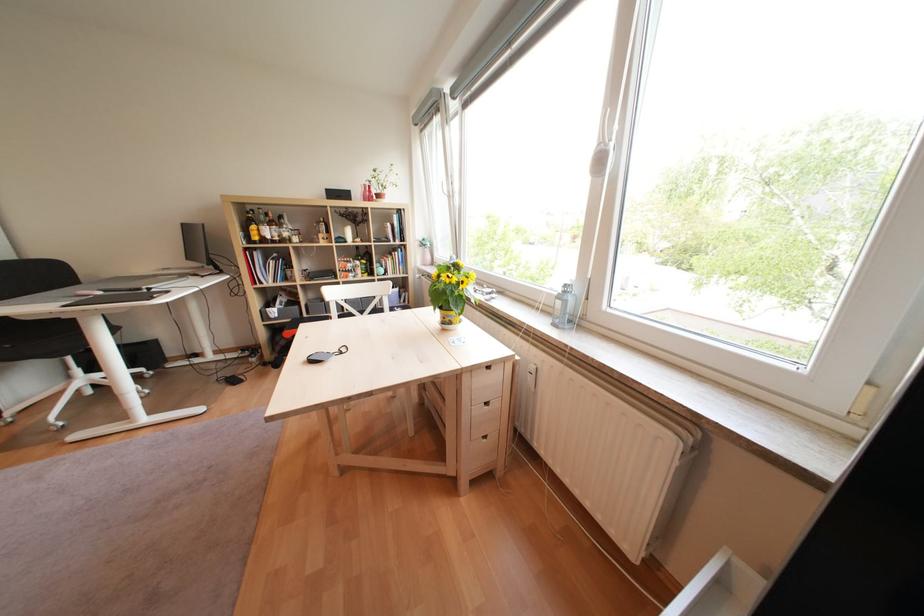
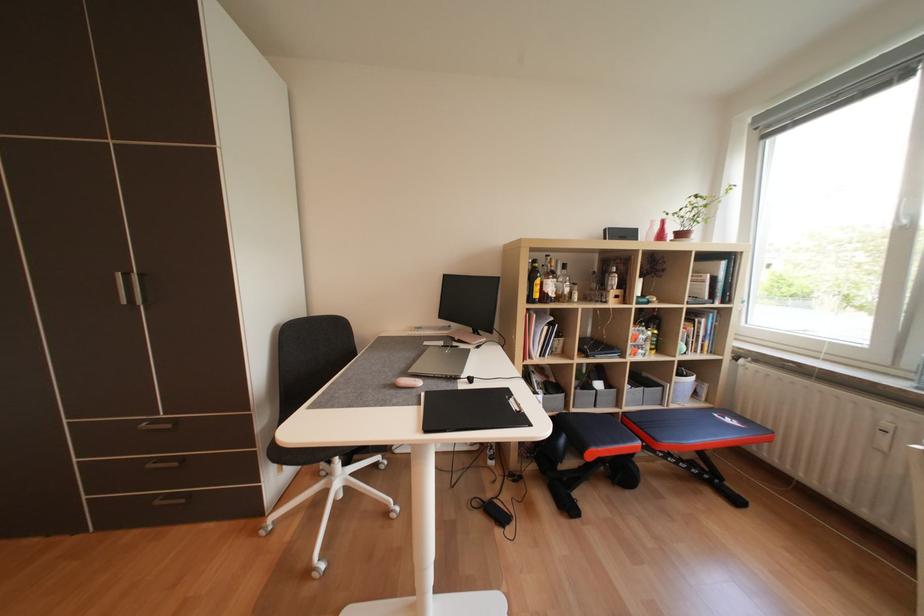
Question: The images are taken continuously from a first-person perspective. In which direction are you moving?

Choices:
 (A) Left
 (B) Right
 (C) Forward
 (D) Backward

Answer: (A)